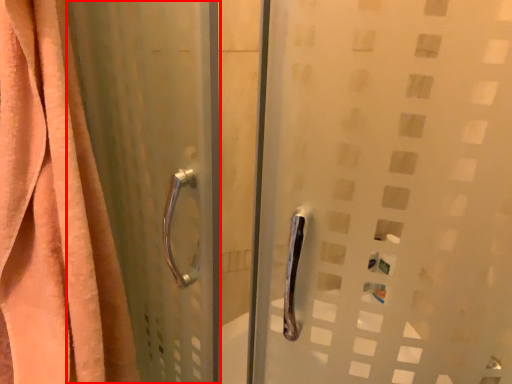
Question: From the image's perspective, where is screen door (annotated by the red box) located relative to curtain?

Choices:
 (A) below
 (B) above

Answer: (A)